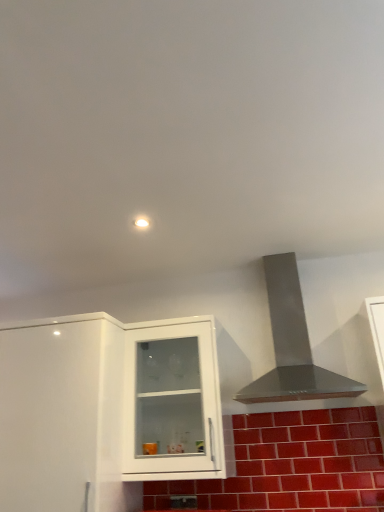
Question: Is glossy ceramic brick at lower center inside the boundaries of stainless steel vent at upper right, or outside?

Choices:
 (A) outside
 (B) inside

Answer: (A)

Question: Is point (375, 436) closer or farther from the camera than point (271, 294)?

Choices:
 (A) farther
 (B) closer

Answer: (B)

Question: Estimate the real-world distances between objects in this image. Which object is closer to the glossy ceramic brick at lower center?

Choices:
 (A) white glossy cabinet at center, positioned as the 1th cabinetry in right-to-left order
 (B) white glossy cabinet at left, positioned as the first cabinetry in left-to-right order
 (C) stainless steel vent at upper right

Answer: (C)

Question: Estimate the real-world distances between objects in this image. Which object is farther from the stainless steel vent at upper right?

Choices:
 (A) white glossy cabinet at left, which ranks as the 2th cabinetry in right-to-left order
 (B) glossy ceramic brick at lower center
 (C) white glossy cabinet at center, positioned as the second cabinetry in left-to-right order

Answer: (A)